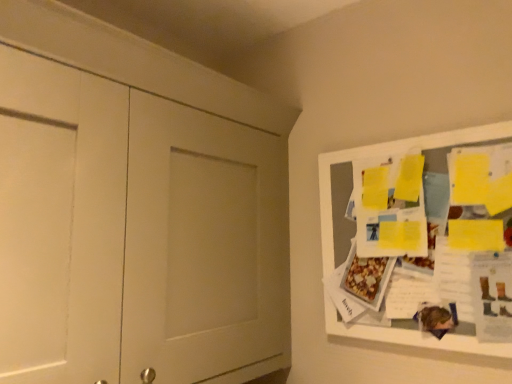
Question: From the image's perspective, is yellow paper at upper right above white matte door at left?

Choices:
 (A) yes
 (B) no

Answer: (B)

Question: Does yellow paper at upper right have a smaller size compared to white matte door at left?

Choices:
 (A) no
 (B) yes

Answer: (B)

Question: From a real-world perspective, is yellow paper at upper right physically below white matte door at left?

Choices:
 (A) yes
 (B) no

Answer: (A)

Question: Can you confirm if yellow paper at upper right is wider than white matte door at left?

Choices:
 (A) yes
 (B) no

Answer: (B)

Question: Can we say yellow paper at upper right lies outside white matte door at left?

Choices:
 (A) no
 (B) yes

Answer: (B)

Question: Is yellow paper at upper right closer to the viewer compared to white matte door at left?

Choices:
 (A) no
 (B) yes

Answer: (A)

Question: From a real-world perspective, is white matte door at left on yellow paper at upper right?

Choices:
 (A) yes
 (B) no

Answer: (A)

Question: Is white matte door at left looking in the opposite direction of yellow paper at upper right?

Choices:
 (A) yes
 (B) no

Answer: (B)

Question: Is white matte door at left smaller than yellow paper at upper right?

Choices:
 (A) no
 (B) yes

Answer: (A)

Question: Does white matte door at left turn towards yellow paper at upper right?

Choices:
 (A) yes
 (B) no

Answer: (A)

Question: From a real-world perspective, is white matte door at left under yellow paper at upper right?

Choices:
 (A) no
 (B) yes

Answer: (A)

Question: Considering the relative positions of white matte door at left and yellow paper at upper right in the image provided, is white matte door at left to the left of yellow paper at upper right from the viewer's perspective?

Choices:
 (A) no
 (B) yes

Answer: (B)

Question: From the image's perspective, is yellow paper at upper right located above or below white matte door at left?

Choices:
 (A) below
 (B) above

Answer: (A)